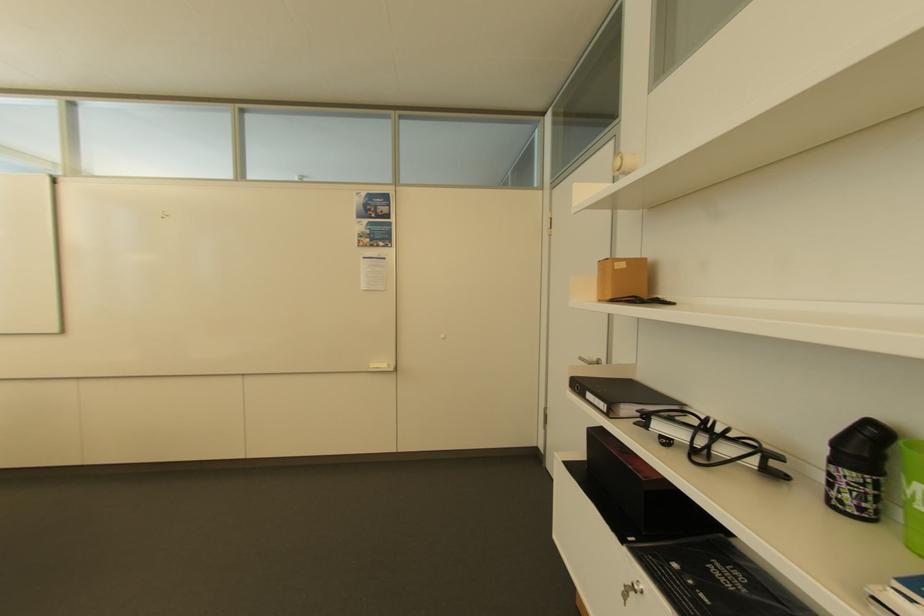
Where would you lift the green plastic cup? Please return your answer as a coordinate pair (x, y).

(912, 493)